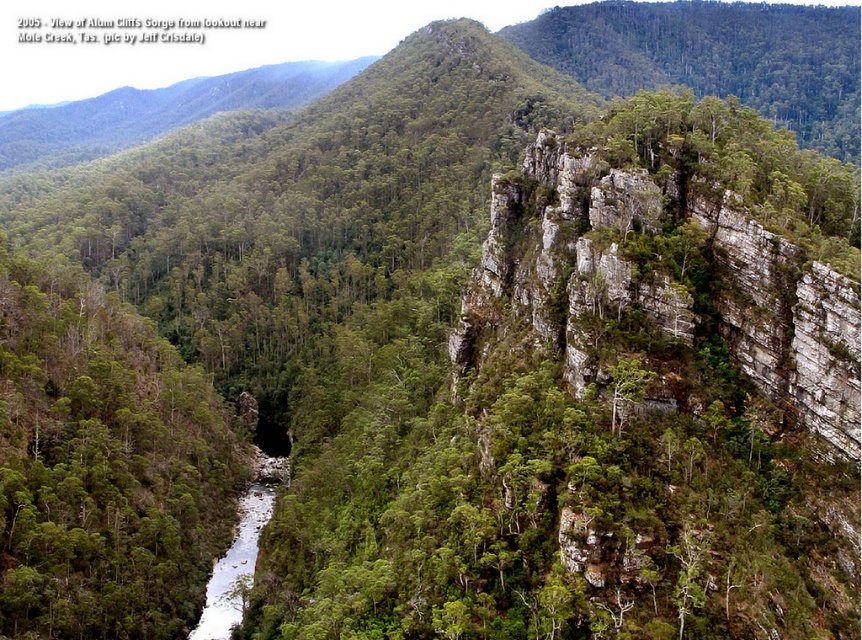
Is green leafy tree at lower left positioned at the back of white smooth river at center?

No, it is not.

In the scene shown: Is green leafy tree at lower left positioned before white smooth river at center?

Yes, green leafy tree at lower left is in front of white smooth river at center.

This screenshot has width=862, height=640. I want to click on green leafy tree at lower left, so click(104, 465).